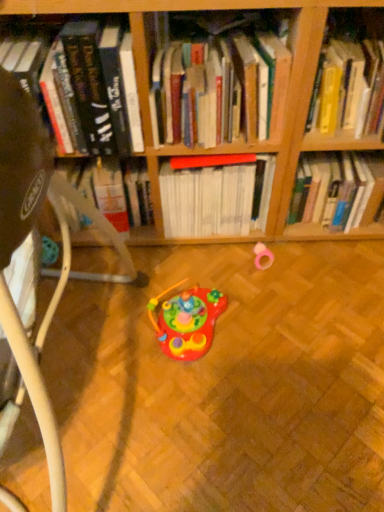
Question: In terms of height, does hardcover books at center, which ranks as the 3th book in right-to-left order, look taller or shorter compared to red matte book at center, acting as the 2th book starting from the right?

Choices:
 (A) short
 (B) tall

Answer: (A)

Question: In terms of width, does hardcover books at center, which ranks as the 3th book in right-to-left order, look wider or thinner when compared to red matte book at center, acting as the 2th book starting from the right?

Choices:
 (A) wide
 (B) thin

Answer: (A)

Question: Estimate the real-world distances between objects in this image. Which object is closer to the white plastic swivel chair at lower left?

Choices:
 (A) pink rubber ring at center right, which is counted as the first toy, starting from the back
 (B) hardcover books at center, which ranks as the 3th book in right-to-left order
 (C) hardcover book at left, the 4th book when ordered from right to left
 (D) red matte book at center, which is the third book in left-to-right order
 (E) yellow hardcover book at upper right, the 4th book viewed from the left

Answer: (C)

Question: Estimate the real-world distances between objects in this image. Which object is closer to the red matte book at center, acting as the 2th book starting from the right?

Choices:
 (A) yellow hardcover book at upper right, which is the first book in right-to-left order
 (B) hardcover book at left, the first book from the left
 (C) white plastic swivel chair at lower left
 (D) pink rubber ring at center right, which ranks as the 1th toy in right-to-left order
 (E) hardcover books at center, which ranks as the 3th book in right-to-left order

Answer: (E)